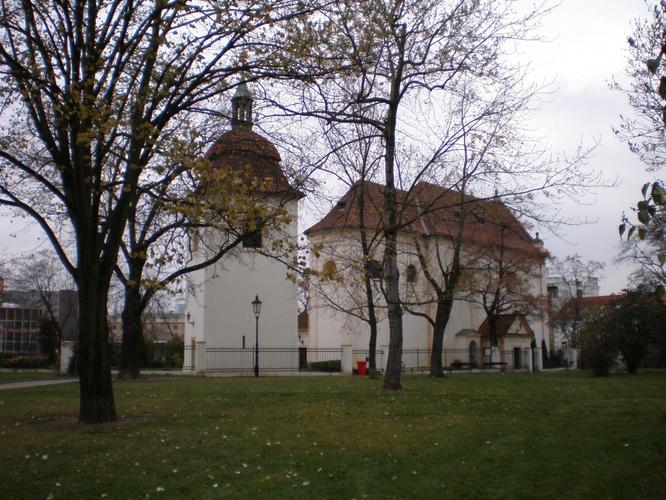
Where is `garbage can`? This screenshot has width=666, height=500. garbage can is located at coordinates (361, 367).